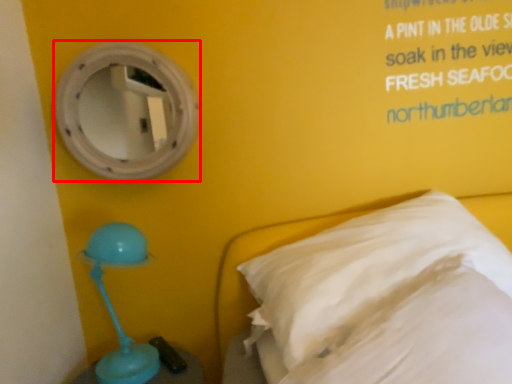
Question: Observing the image, what is the correct spatial positioning of mirror (annotated by the red box) in reference to pillow?

Choices:
 (A) left
 (B) right

Answer: (A)